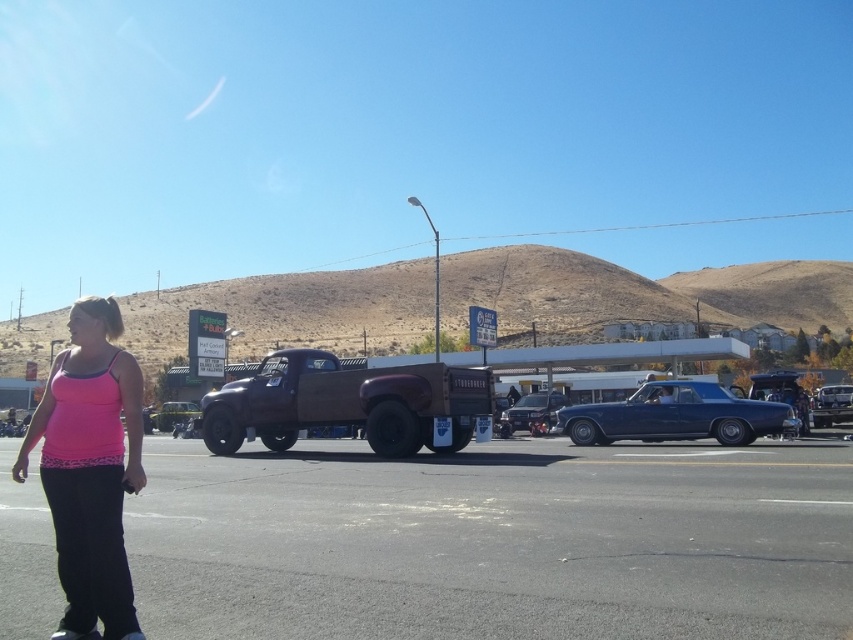
Between pink fabric tank top at lower left and shiny chrome motorcycle at center, which one appears on the left side from the viewer's perspective?

From the viewer's perspective, pink fabric tank top at lower left appears more on the left side.

Does pink fabric tank top at lower left have a larger size compared to shiny chrome motorcycle at center?

Yes.

The image size is (853, 640). Identify the location of pink fabric tank top at lower left. (90, 468).

Is pink fabric tank top at lower left shorter than shiny maroon truck at center?

In fact, pink fabric tank top at lower left may be taller than shiny maroon truck at center.

You are a GUI agent. You are given a task and a screenshot of the screen. Output one action in this format:
    pyautogui.click(x=<x>, y=<y>)
    Task: Click on the pink fabric tank top at lower left
    
    Given the screenshot: What is the action you would take?
    pyautogui.click(x=90, y=468)

In order to click on pink fabric tank top at lower left in this screenshot , I will do `click(90, 468)`.

Who is lower down, asphalt at lower center or shiny maroon truck at center?

Positioned lower is asphalt at lower center.

Can you confirm if asphalt at lower center is taller than shiny maroon truck at center?

In fact, asphalt at lower center may be shorter than shiny maroon truck at center.

Is point (328, 588) in front of point (351, 394)?

Yes, it is.

Where is `asphalt at lower center`? This screenshot has width=853, height=640. asphalt at lower center is located at coordinates (494, 541).